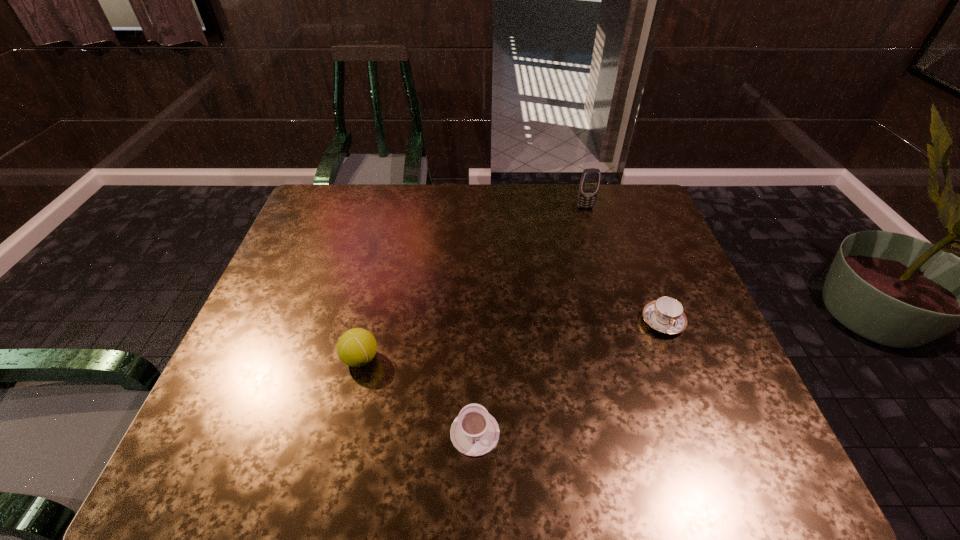
You are a GUI agent. You are given a task and a screenshot of the screen. Output one action in this format:
    pyautogui.click(x=<x>, y=<y>)
    Task: Click on the object that stands as the closest to the farther teacup
    This screenshot has height=540, width=960.
    Given the screenshot: What is the action you would take?
    pyautogui.click(x=474, y=432)